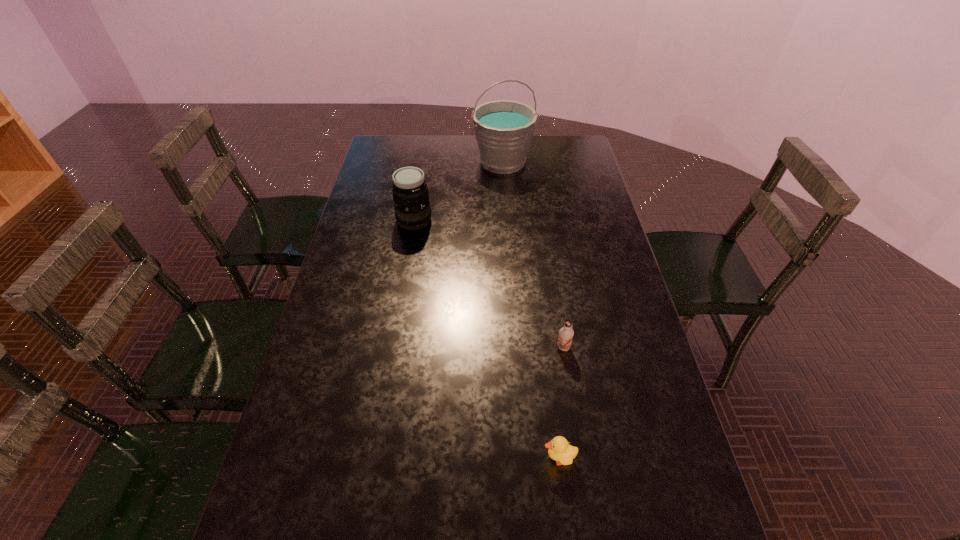
Find the location of a particular element. This screenshot has height=540, width=960. the tallest object is located at coordinates (504, 129).

Locate an element on the screen. This screenshot has width=960, height=540. bucket is located at coordinates (504, 129).

The height and width of the screenshot is (540, 960). Find the location of `the leftmost object`. the leftmost object is located at coordinates (410, 193).

The image size is (960, 540). I want to click on the third shortest object, so click(x=410, y=193).

Image resolution: width=960 pixels, height=540 pixels. Identify the location of the third tallest object. (566, 333).

This screenshot has width=960, height=540. I want to click on chocolate milk, so click(566, 333).

You are a GUI agent. You are given a task and a screenshot of the screen. Output one action in this format:
    pyautogui.click(x=<x>, y=<y>)
    Task: Click on the duckling
    The height and width of the screenshot is (540, 960).
    Given the screenshot: What is the action you would take?
    pyautogui.click(x=559, y=450)

Locate an element on the screen. the nearest object is located at coordinates (559, 450).

The height and width of the screenshot is (540, 960). What are the coordinates of `vacant area located 0.070m on the right of the tallest object` in the screenshot? It's located at (550, 162).

Where is `vacant region located on the back of the second tallest object`? The height and width of the screenshot is (540, 960). vacant region located on the back of the second tallest object is located at coordinates [421, 177].